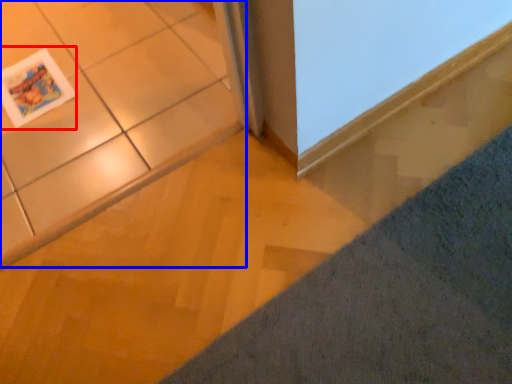
Question: Which point is further to the camera, magazine (highlighted by a red box) or ceramic tile (highlighted by a blue box)?

Choices:
 (A) magazine
 (B) ceramic tile

Answer: (A)